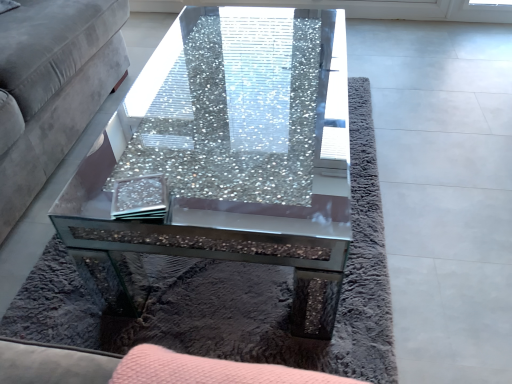
Question: Is clear glass coaster at center thinner than crushed glass coffee table at center?

Choices:
 (A) no
 (B) yes

Answer: (B)

Question: Does clear glass coaster at center have a larger size compared to crushed glass coffee table at center?

Choices:
 (A) yes
 (B) no

Answer: (B)

Question: Would you consider clear glass coaster at center to be distant from crushed glass coffee table at center?

Choices:
 (A) no
 (B) yes

Answer: (A)

Question: From a real-world perspective, is clear glass coaster at center physically below crushed glass coffee table at center?

Choices:
 (A) yes
 (B) no

Answer: (B)

Question: Does clear glass coaster at center lie behind crushed glass coffee table at center?

Choices:
 (A) yes
 (B) no

Answer: (A)

Question: In the image, is crushed glass coffee table at center positioned in front of or behind clear glass coaster at center?

Choices:
 (A) front
 (B) behind

Answer: (A)

Question: Is crushed glass coffee table at center situated inside clear glass coaster at center or outside?

Choices:
 (A) inside
 (B) outside

Answer: (B)

Question: Is point (289, 196) closer or farther from the camera than point (154, 198)?

Choices:
 (A) closer
 (B) farther

Answer: (B)

Question: Is crushed glass coffee table at center wider or thinner than clear glass coaster at center?

Choices:
 (A) wide
 (B) thin

Answer: (A)

Question: In terms of width, does velvet grey couch at left look wider or thinner when compared to crushed glass coffee table at center?

Choices:
 (A) wide
 (B) thin

Answer: (A)

Question: Considering the relative positions of velvet grey couch at left and crushed glass coffee table at center in the image provided, is velvet grey couch at left to the left or to the right of crushed glass coffee table at center?

Choices:
 (A) left
 (B) right

Answer: (A)

Question: Is point (44, 44) positioned closer to the camera than point (289, 102)?

Choices:
 (A) closer
 (B) farther

Answer: (B)

Question: Considering their positions, is velvet grey couch at left located in front of or behind crushed glass coffee table at center?

Choices:
 (A) behind
 (B) front

Answer: (B)

Question: Does point (340, 11) appear closer or farther from the camera than point (54, 41)?

Choices:
 (A) farther
 (B) closer

Answer: (A)

Question: Considering the relative positions of crushed glass coffee table at center and velvet grey couch at left in the image provided, is crushed glass coffee table at center to the left or to the right of velvet grey couch at left?

Choices:
 (A) right
 (B) left

Answer: (A)